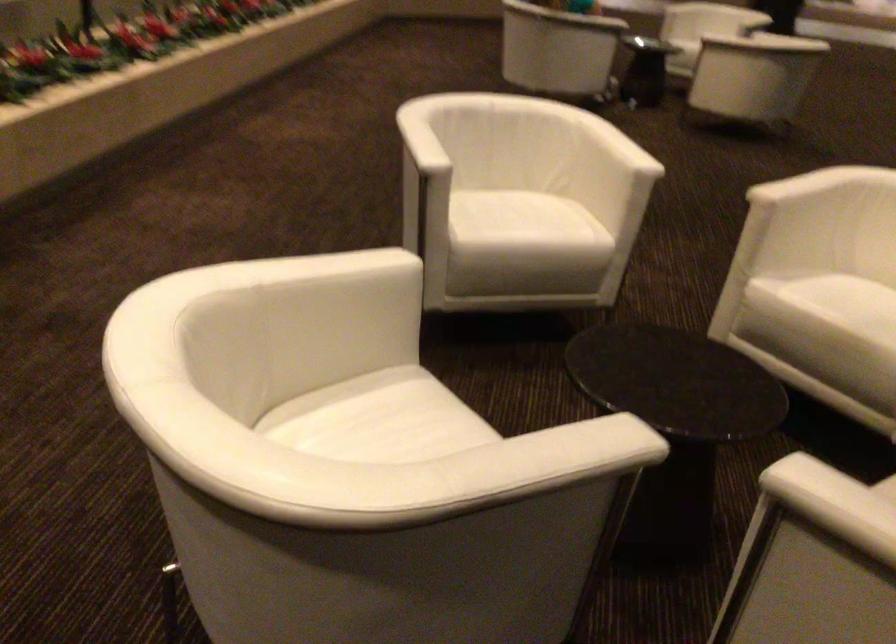
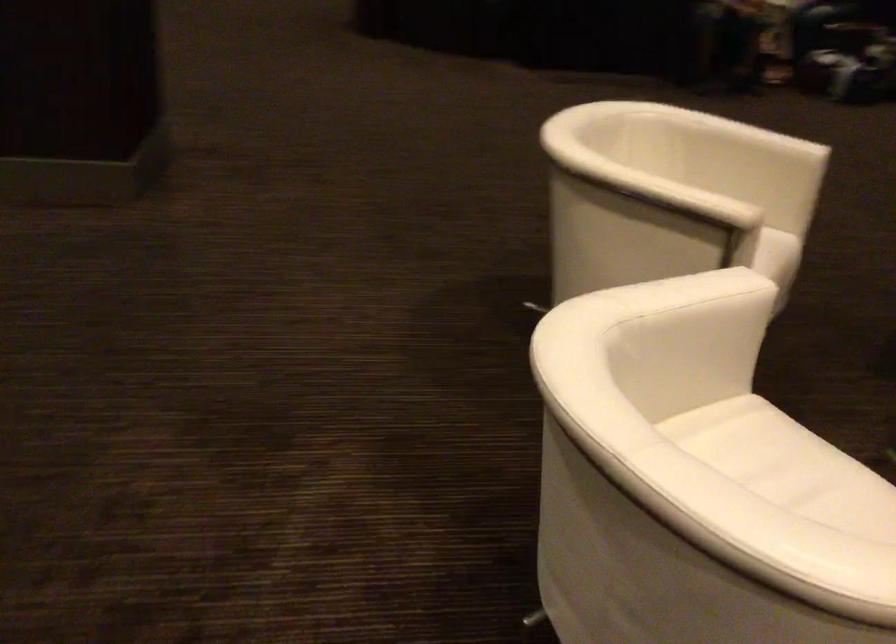
In the second image, find the point that corresponds to point 762,232 in the first image.

(676, 261)